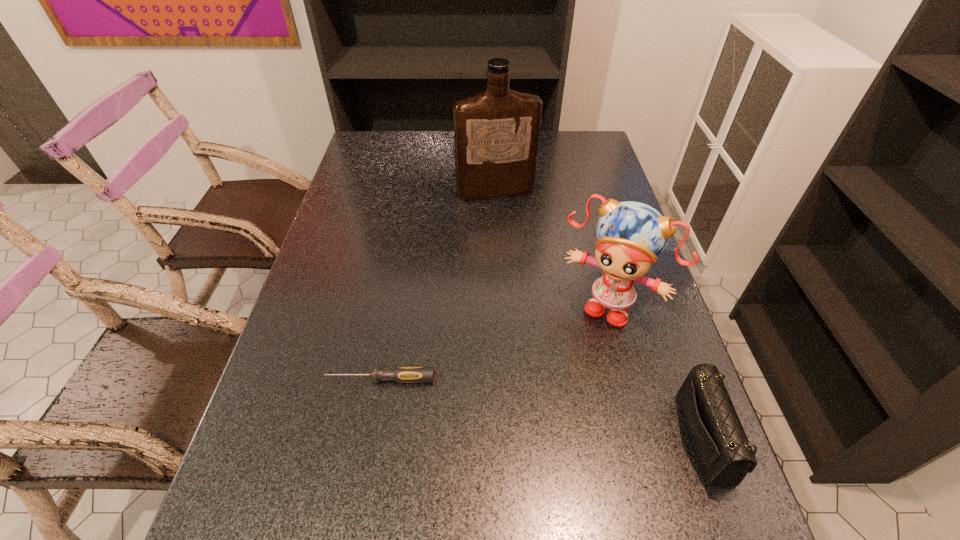
The height and width of the screenshot is (540, 960). Identify the location of free space at the near edge. (446, 496).

Identify the location of vacant region at the left edge. (389, 170).

This screenshot has width=960, height=540. I want to click on vacant space at the right edge of the desktop, so click(583, 234).

This screenshot has height=540, width=960. In the image, there is a desktop. What are the coordinates of `vacant space at the far left corner` in the screenshot? It's located at (396, 134).

In the image, there is a desktop. What are the coordinates of `vacant space at the far right corner` in the screenshot? It's located at (595, 154).

Image resolution: width=960 pixels, height=540 pixels. In order to click on vacant space at the near right corner of the desktop in this screenshot , I will do `click(634, 471)`.

The height and width of the screenshot is (540, 960). What are the coordinates of `vacant area between the third farthest object and the doll` in the screenshot? It's located at (495, 342).

Locate an element on the screen. This screenshot has width=960, height=540. empty space that is in between the second shortest object and the third nearest object is located at coordinates (660, 372).

Where is `unoccupied position between the second shortest object and the tallest object`? This screenshot has width=960, height=540. unoccupied position between the second shortest object and the tallest object is located at coordinates (603, 315).

This screenshot has height=540, width=960. Identify the location of blank region between the clutch bag and the third object from right to left. (603, 315).